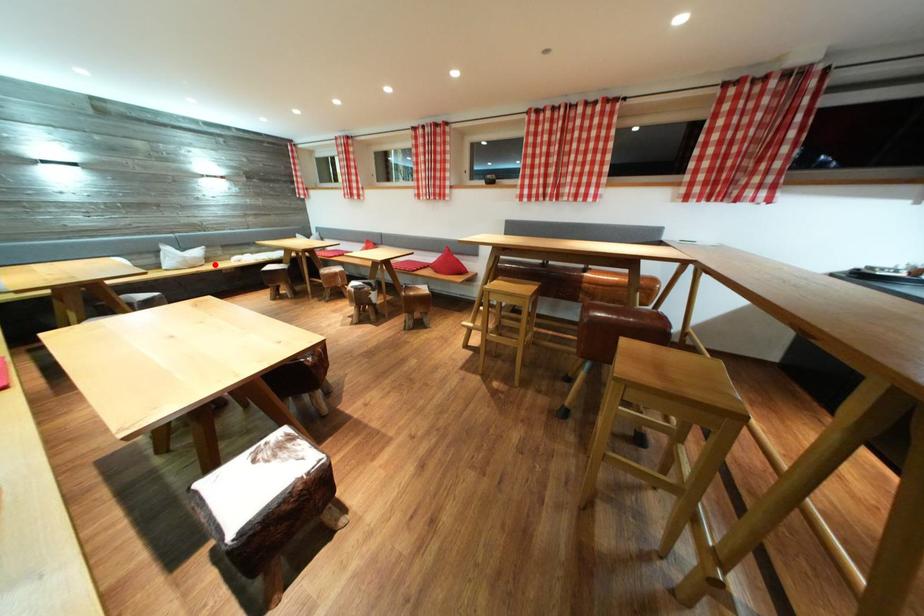
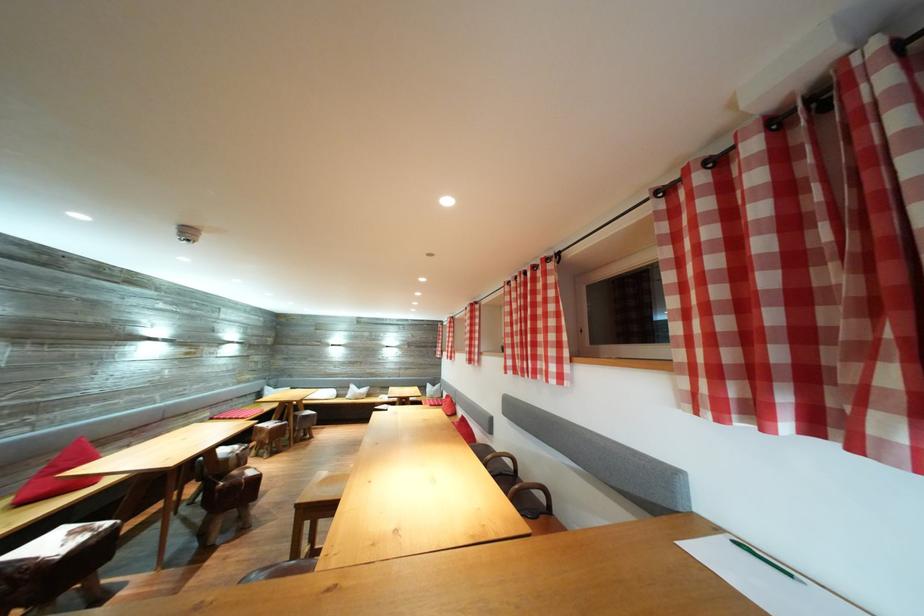
Question: A red point is marked in image1. In image2, is the corresponding 3D point closer to the camera or farther? Reply with the corresponding letter.

Choices:
 (A) The corresponding 3D point is closer.
 (B) The corresponding 3D point is farther.

Answer: (B)